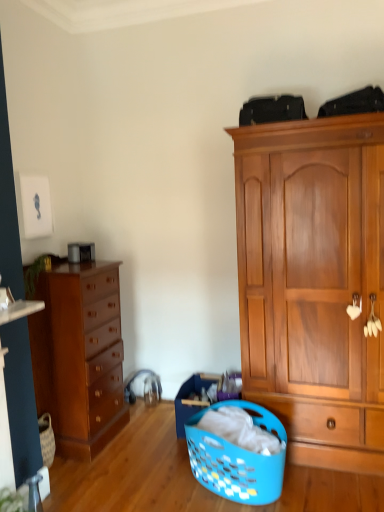
Question: Is shiny brown dresser at left situated inside wooden cabinet at right or outside?

Choices:
 (A) inside
 (B) outside

Answer: (B)

Question: Considering the relative positions of shiny brown dresser at left and wooden cabinet at right in the image provided, is shiny brown dresser at left to the left or to the right of wooden cabinet at right?

Choices:
 (A) left
 (B) right

Answer: (A)

Question: Based on their relative distances, which object is farther from the wooden cabinet at right?

Choices:
 (A) blue plastic laundry basket at lower center
 (B) shiny brown dresser at left

Answer: (B)

Question: Which of these objects is positioned closest to the wooden cabinet at right?

Choices:
 (A) blue plastic laundry basket at lower center
 (B) shiny brown dresser at left

Answer: (A)